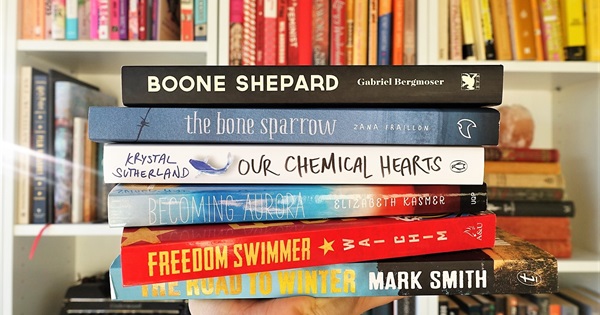
Identify the location of books in pile. This screenshot has height=315, width=600. (338, 75), (319, 115), (314, 158), (305, 196), (312, 233), (309, 280).